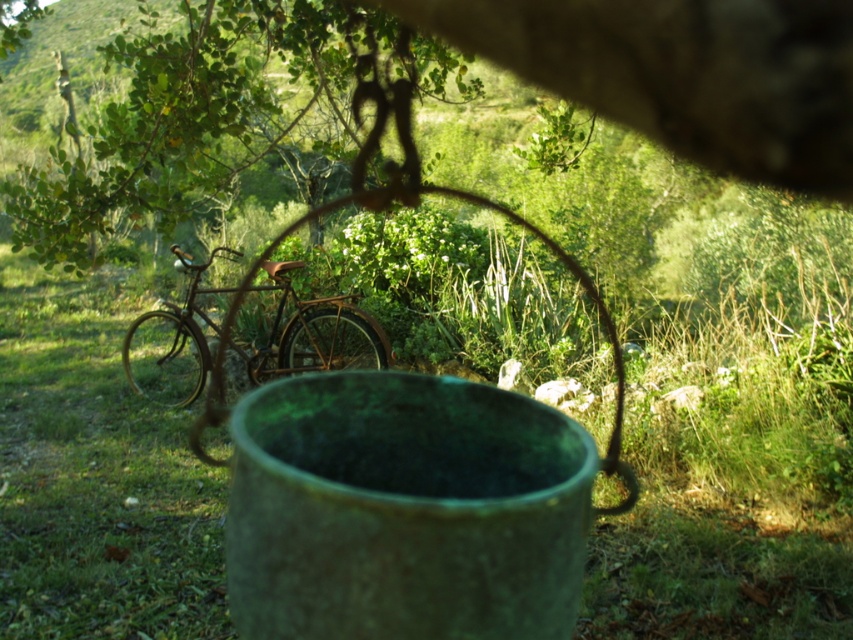
You are standing in the middle of the scene and want to look at the green leafy tree at upper center and the rusty metal bicycle at center. Which object is positioned to the right side of the other?

The green leafy tree at upper center is positioned to the right of the rusty metal bicycle at center.

You are a painter standing 10 feet away from the green leafy tree at upper center. You want to paint the rusty metal bicycle at center. Can you reach it without moving from your current position?

The distance between the green leafy tree at upper center and the rusty metal bicycle at center is 11.16 feet. Since you are 10 feet away from the tree, you are 1 foot away from the bicycle, so you can reach it without moving.